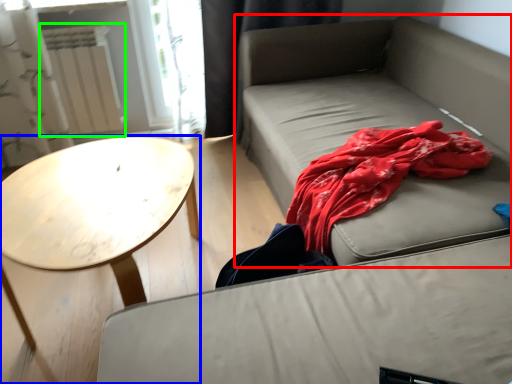
Question: Which object is positioned farthest from studio couch (highlighted by a red box)? Select from coffee table (highlighted by a blue box) and radiator (highlighted by a green box).

Choices:
 (A) coffee table
 (B) radiator

Answer: (B)